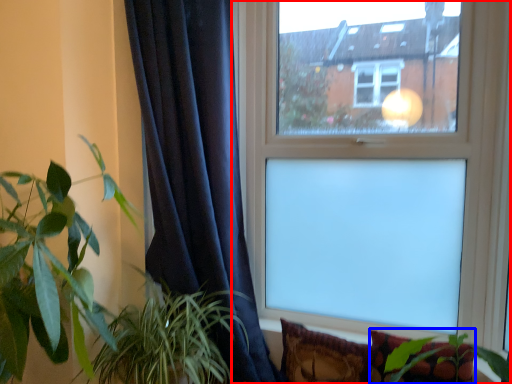
Question: Among these objects, which one is nearest to the camera, window (highlighted by a red box) or pillow (highlighted by a blue box)?

Choices:
 (A) window
 (B) pillow

Answer: (B)